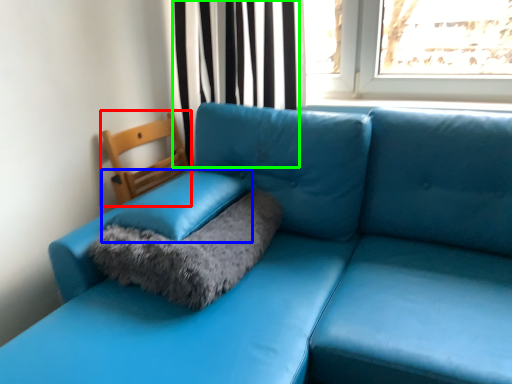
Question: Which object is positioned farthest from armchair (highlighted by a red box)? Select from pillow (highlighted by a blue box) and curtain (highlighted by a green box).

Choices:
 (A) pillow
 (B) curtain

Answer: (A)